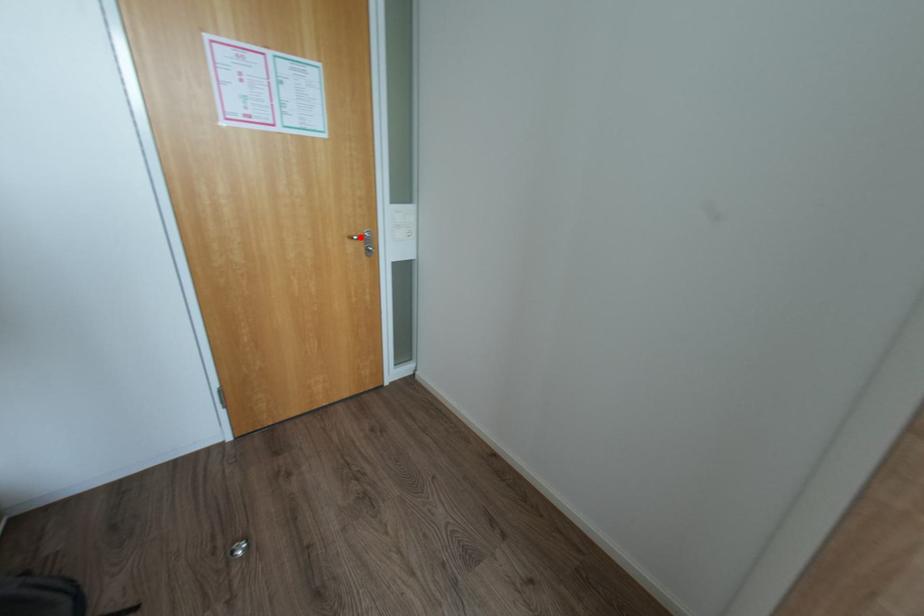
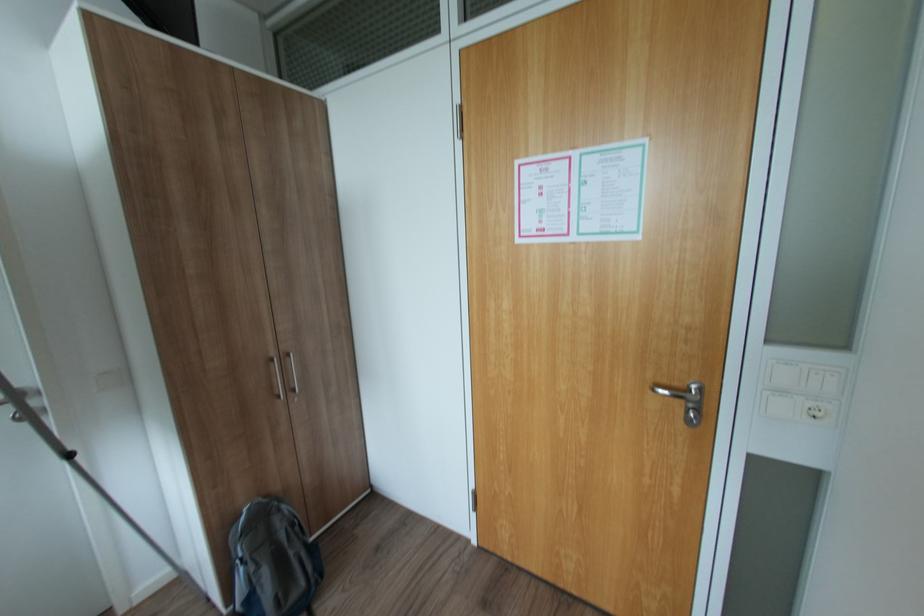
Question: I am providing you with two images of the same scene from different viewpoints. A red point is marked on the first image. Is the red point's position out of view in image 2?

Choices:
 (A) Yes
 (B) No

Answer: (B)